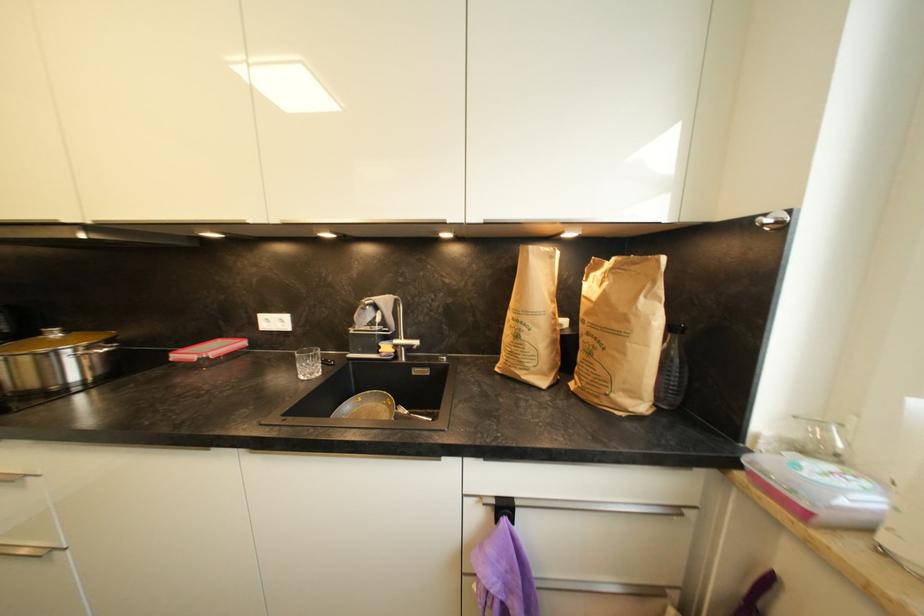
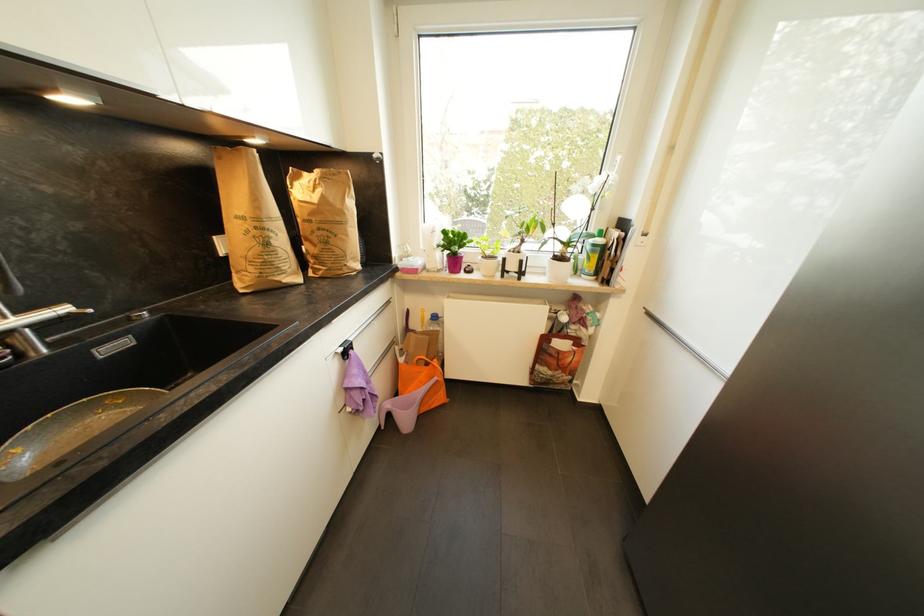
The point at [521,338] is marked in the first image. Where is the corresponding point in the second image?

(272, 246)